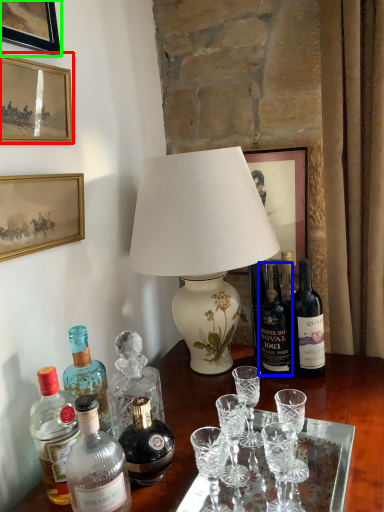
Question: Considering the real-world distances, which object is farthest from picture frame (highlighted by a red box)? bottle (highlighted by a blue box) or picture frame (highlighted by a green box)?

Choices:
 (A) bottle
 (B) picture frame

Answer: (A)